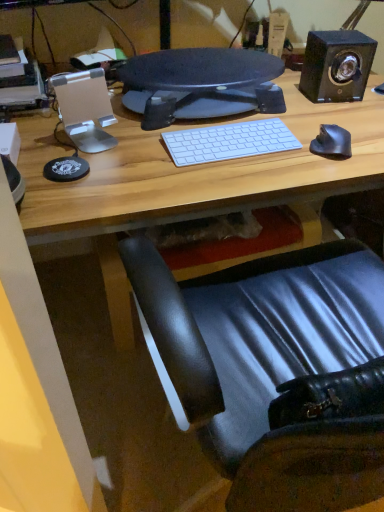
Question: Would you say black glossy speaker at upper right is inside or outside matte black monitor at center?

Choices:
 (A) inside
 (B) outside

Answer: (B)

Question: Is black glossy speaker at upper right wider or thinner than matte black monitor at center?

Choices:
 (A) thin
 (B) wide

Answer: (A)

Question: Which object is the farthest from the black glossy speaker at upper right?

Choices:
 (A) white matte keyboard at center
 (B) black leather chair at lower right
 (C) black rubberized mouse at right
 (D) matte black monitor at center

Answer: (B)

Question: Which object is positioned closest to the black glossy speaker at upper right?

Choices:
 (A) matte black monitor at center
 (B) white matte keyboard at center
 (C) black leather chair at lower right
 (D) black rubberized mouse at right

Answer: (D)